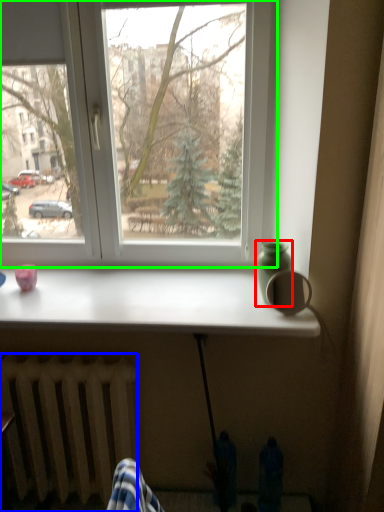
Question: Which object is positioned closest to glass vase (highlighted by a red box)? Select from radiator (highlighted by a blue box) and window (highlighted by a green box).

Choices:
 (A) radiator
 (B) window

Answer: (B)